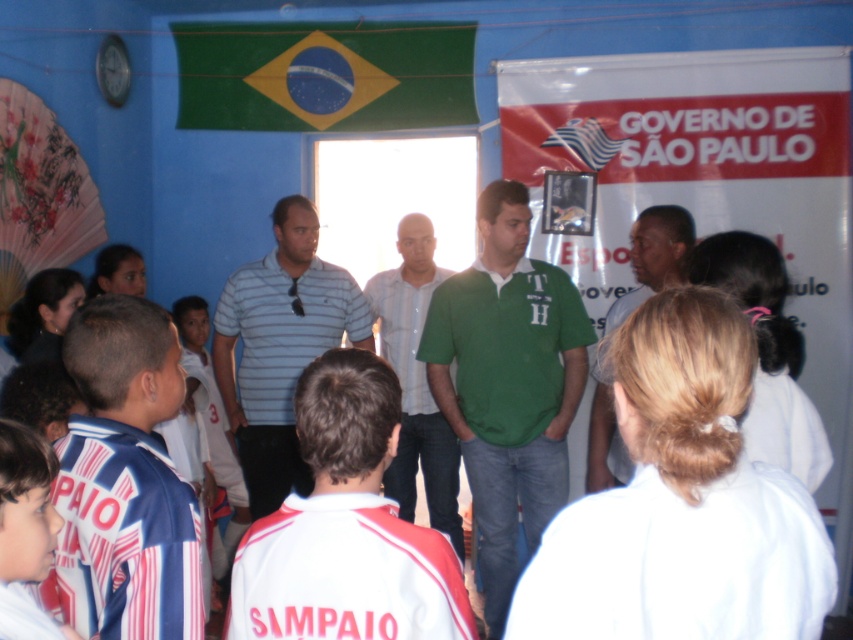
Based on the photo, can you confirm if blue and white striped jersey at lower left is taller than blonde hair at upper right?

No, blue and white striped jersey at lower left is not taller than blonde hair at upper right.

Which is above, blue and white striped jersey at lower left or blonde hair at upper right?

Positioned higher is blonde hair at upper right.

I want to click on blue and white striped jersey at lower left, so click(123, 536).

Where is `blue and white striped jersey at lower left`? blue and white striped jersey at lower left is located at coordinates (123, 536).

From the picture: Is the position of light blue striped shirt at center more distant than that of white glossy flag at upper center?

No, light blue striped shirt at center is closer to the viewer.

Between light blue striped shirt at center and white glossy flag at upper center, which one is positioned lower?

light blue striped shirt at center is lower down.

At what (x,y) coordinates should I click in order to perform the action: click on light blue striped shirt at center. Please return your answer as a coordinate pair (x, y). The width and height of the screenshot is (853, 640). Looking at the image, I should click on (416, 381).

What are the coordinates of `light blue striped shirt at center` in the screenshot? It's located at (416, 381).

Is the position of green fabric flag at upper center less distant than that of white cotton shirt at center?

No, green fabric flag at upper center is behind white cotton shirt at center.

Between point (438, 51) and point (410, 404), which one is positioned in front?

Positioned in front is point (410, 404).

Identify the location of green fabric flag at upper center. The image size is (853, 640). (323, 76).